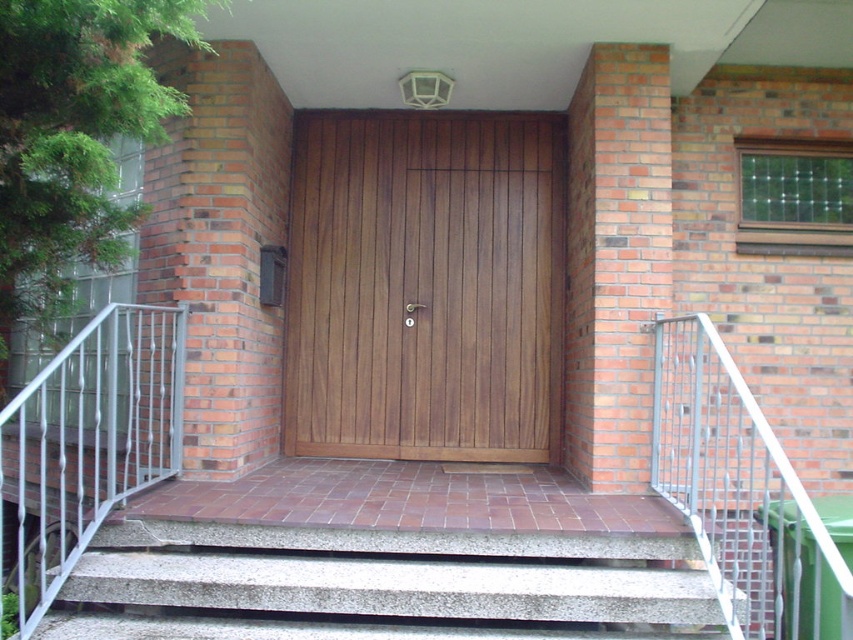
Question: Does wooden door at center have a greater width compared to gray concrete stairs at lower left?

Choices:
 (A) yes
 (B) no

Answer: (B)

Question: Based on their relative distances, which object is farther from the gray concrete stairs at lower left?

Choices:
 (A) wooden door at center
 (B) metallic silver railing at right

Answer: (A)

Question: Which point is farther to the camera?

Choices:
 (A) (717, 630)
 (B) (163, 429)

Answer: (B)

Question: Does gray concrete stairs at lower left come in front of white metal balustrade at left?

Choices:
 (A) no
 (B) yes

Answer: (A)

Question: Which point appears farthest from the camera in this image?

Choices:
 (A) (161, 333)
 (B) (252, 536)

Answer: (A)

Question: Can you confirm if white metal balustrade at left is positioned below metallic silver railing at right?

Choices:
 (A) no
 (B) yes

Answer: (A)